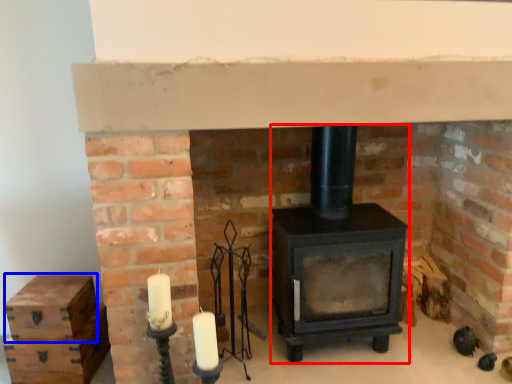
Question: Which object is further to the camera taking this photo, wood burning stove (highlighted by a red box) or drawer (highlighted by a blue box)?

Choices:
 (A) wood burning stove
 (B) drawer

Answer: (B)